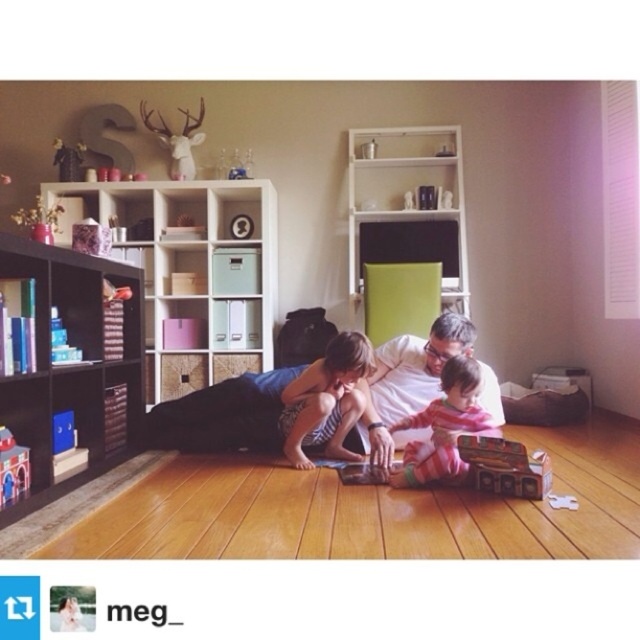
You are a guest entering the room and want to greet the person in the white cotton shirt at center. Which direction should you walk from the matte black bookshelf at left to reach them?

You should walk to the right from the matte black bookshelf at left to reach the white cotton shirt at center, as the white cotton shirt at center is to the right of the matte black bookshelf at left according to the description.

You are a delivery person who needs to place a large package on the black matte bookshelf at left. Given that the bookshelf is located at coordinates 0.581, 0.111, can you confirm its position relative to the main window on the right side of the room?

The black matte bookshelf at left is positioned at coordinates (70, 371), which places it to the left side of the room, opposite the main window on the right side.

You are standing at the point labeled point (125, 250) and want to walk to the point labeled point (508, 440). Which direction should you face to move towards your destination?

You should face forward because point (125, 250) is behind point (508, 440), so moving forward from point (125, 250) will take you toward point (508, 440).